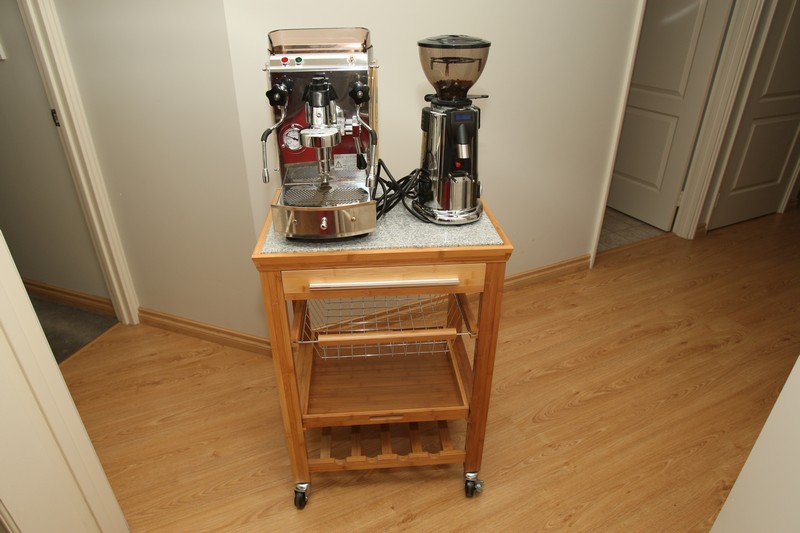
You are a GUI agent. You are given a task and a screenshot of the screen. Output one action in this format:
    pyautogui.click(x=<x>, y=<y>)
    Task: Click on the floor
    The width and height of the screenshot is (800, 533).
    Given the screenshot: What is the action you would take?
    pyautogui.click(x=620, y=456)